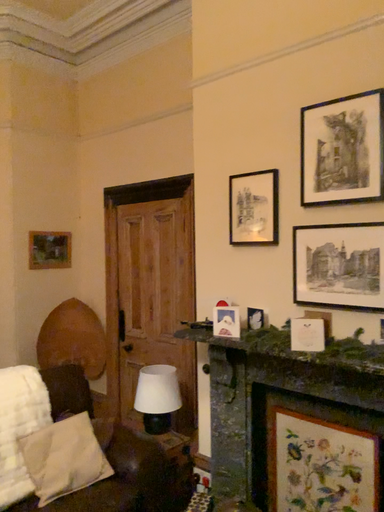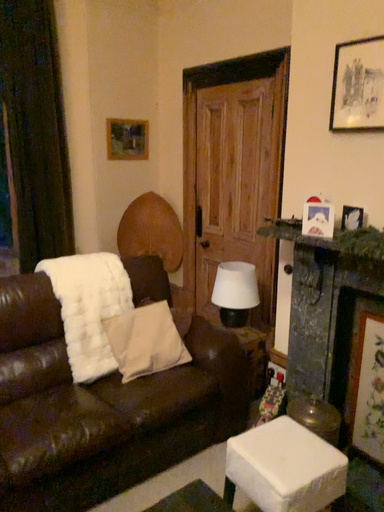
Question: Which way did the camera rotate in the video?

Choices:
 (A) rotated right
 (B) rotated left

Answer: (B)